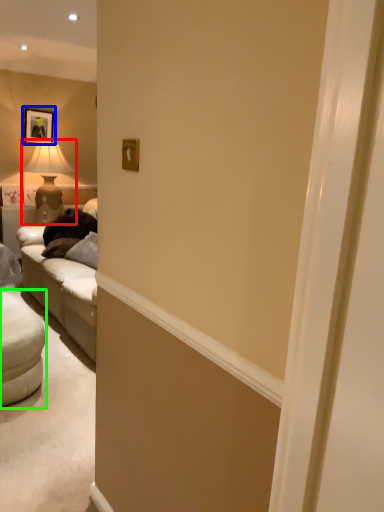
Question: Which is nearer to the table lamp (highlighted by a red box)? picture frame (highlighted by a blue box) or studio couch (highlighted by a green box).

Choices:
 (A) picture frame
 (B) studio couch

Answer: (A)